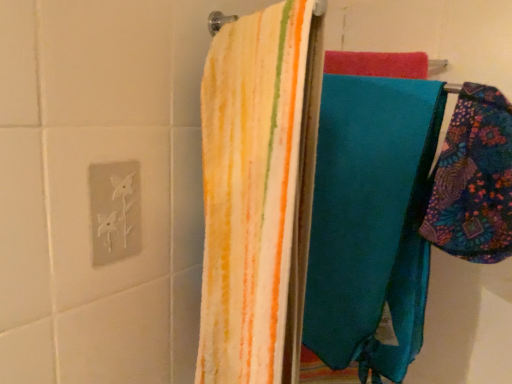
Question: Can we say floral patchwork fabric at right lies outside white matte electric outlet at upper left?

Choices:
 (A) yes
 (B) no

Answer: (A)

Question: Is the surface of floral patchwork fabric at right in direct contact with white matte electric outlet at upper left?

Choices:
 (A) no
 (B) yes

Answer: (A)

Question: Is floral patchwork fabric at right thinner than white matte electric outlet at upper left?

Choices:
 (A) yes
 (B) no

Answer: (B)

Question: Can you confirm if floral patchwork fabric at right is smaller than white matte electric outlet at upper left?

Choices:
 (A) yes
 (B) no

Answer: (B)

Question: From the image's perspective, is floral patchwork fabric at right above white matte electric outlet at upper left?

Choices:
 (A) no
 (B) yes

Answer: (B)

Question: Considering the relative positions of floral patchwork fabric at right and white matte electric outlet at upper left in the image provided, is floral patchwork fabric at right behind white matte electric outlet at upper left?

Choices:
 (A) yes
 (B) no

Answer: (B)

Question: From the image's perspective, would you say white matte electric outlet at upper left is shown under floral patchwork fabric at right?

Choices:
 (A) no
 (B) yes

Answer: (B)

Question: Are white matte electric outlet at upper left and floral patchwork fabric at right far apart?

Choices:
 (A) no
 (B) yes

Answer: (A)

Question: Can you confirm if white matte electric outlet at upper left is smaller than floral patchwork fabric at right?

Choices:
 (A) yes
 (B) no

Answer: (A)

Question: Would you say white matte electric outlet at upper left is outside floral patchwork fabric at right?

Choices:
 (A) no
 (B) yes

Answer: (B)

Question: Is white matte electric outlet at upper left positioned before floral patchwork fabric at right?

Choices:
 (A) yes
 (B) no

Answer: (B)

Question: Considering the relative sizes of white matte electric outlet at upper left and floral patchwork fabric at right in the image provided, is white matte electric outlet at upper left thinner than floral patchwork fabric at right?

Choices:
 (A) no
 (B) yes

Answer: (B)

Question: Considering the positions of point pos(438,243) and point pos(108,195), is point pos(438,243) closer or farther from the camera than point pos(108,195)?

Choices:
 (A) closer
 (B) farther

Answer: (A)